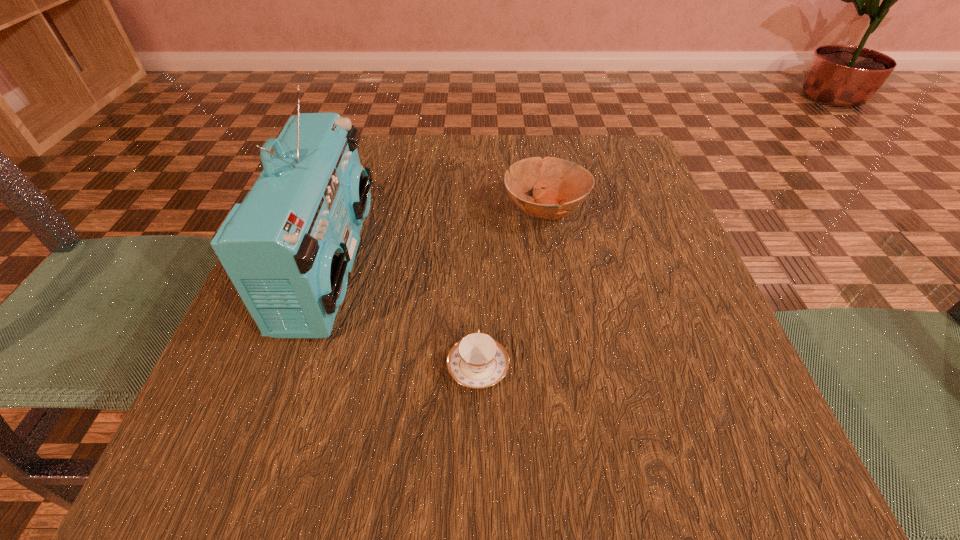
I want to click on free space between the leftmost object and the shortest object, so [404, 316].

In order to click on free area in between the leftmost object and the rightmost object in this screenshot , I will do `click(438, 237)`.

Where is `free area in between the leftmost object and the second shortest object`? The image size is (960, 540). free area in between the leftmost object and the second shortest object is located at coordinates (438, 237).

This screenshot has width=960, height=540. What are the coordinates of `free area in between the second object from left to right and the rightmost object` in the screenshot? It's located at (512, 288).

Where is `free area in between the bowl and the leftmost object`? free area in between the bowl and the leftmost object is located at coordinates (438, 237).

Locate an element on the screen. vacant space that is in between the bowl and the second object from right to left is located at coordinates (512, 288).

Image resolution: width=960 pixels, height=540 pixels. Find the location of `vacant region between the radio receiver and the second tallest object`. vacant region between the radio receiver and the second tallest object is located at coordinates (438, 237).

Find the location of `vacant space that is in between the second object from right to left and the radio receiver`. vacant space that is in between the second object from right to left and the radio receiver is located at coordinates (404, 316).

In order to click on free spot between the radio receiver and the rightmost object in this screenshot , I will do `click(438, 237)`.

Identify the location of free space between the second object from left to right and the second shortest object. (512, 288).